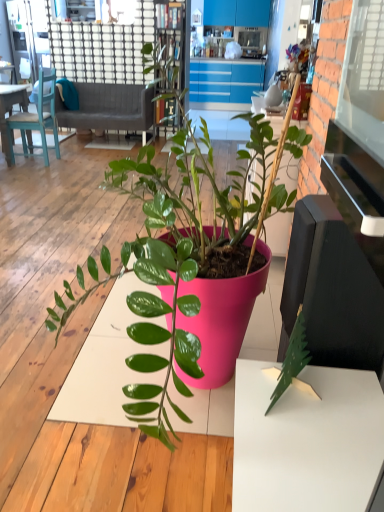
Question: Is gray fabric couch at upper left bigger than matte plastic figurine at upper center?

Choices:
 (A) yes
 (B) no

Answer: (A)

Question: From the image's perspective, does gray fabric couch at upper left appear lower than matte plastic figurine at upper center?

Choices:
 (A) yes
 (B) no

Answer: (A)

Question: From a real-world perspective, does gray fabric couch at upper left sit lower than matte plastic figurine at upper center?

Choices:
 (A) yes
 (B) no

Answer: (A)

Question: Can you confirm if gray fabric couch at upper left is positioned to the right of matte plastic figurine at upper center?

Choices:
 (A) no
 (B) yes

Answer: (A)

Question: Are gray fabric couch at upper left and matte plastic figurine at upper center making contact?

Choices:
 (A) yes
 (B) no

Answer: (B)

Question: From a real-world perspective, relative to gray fabric couch at upper left, is matte blue desk at left vertically above or below?

Choices:
 (A) below
 (B) above

Answer: (B)

Question: Looking at their shapes, would you say matte blue desk at left is wider or thinner than gray fabric couch at upper left?

Choices:
 (A) thin
 (B) wide

Answer: (A)

Question: From the image's perspective, relative to gray fabric couch at upper left, is matte blue desk at left above or below?

Choices:
 (A) below
 (B) above

Answer: (A)

Question: Relative to gray fabric couch at upper left, is matte blue desk at left in front or behind?

Choices:
 (A) front
 (B) behind

Answer: (A)

Question: Looking at the image, does matte plastic figurine at upper center seem bigger or smaller compared to gray fabric couch at upper left?

Choices:
 (A) big
 (B) small

Answer: (B)

Question: Is matte plastic figurine at upper center taller or shorter than gray fabric couch at upper left?

Choices:
 (A) tall
 (B) short

Answer: (B)

Question: From a real-world perspective, is matte plastic figurine at upper center physically located above or below gray fabric couch at upper left?

Choices:
 (A) below
 (B) above

Answer: (B)

Question: Is point (301, 53) closer or farther from the camera than point (140, 104)?

Choices:
 (A) closer
 (B) farther

Answer: (A)

Question: Looking at the image, does wooden bookshelf at upper center seem bigger or smaller compared to matte pink pot at center?

Choices:
 (A) small
 (B) big

Answer: (A)

Question: Visually, is wooden bookshelf at upper center positioned to the left or to the right of matte pink pot at center?

Choices:
 (A) right
 (B) left

Answer: (B)